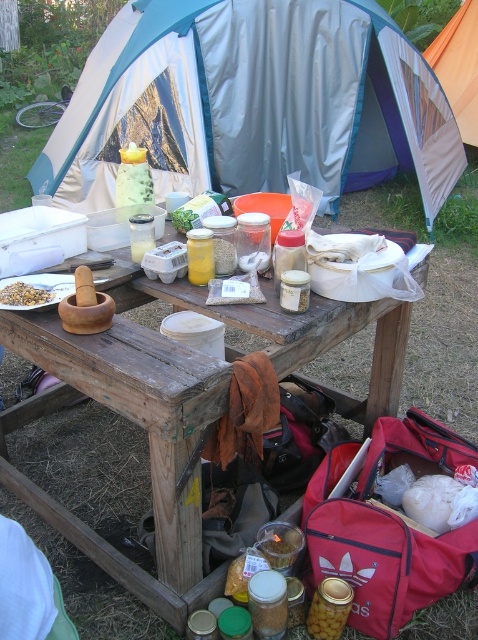
Which is above, orange fabric tent at upper center or yellow glass jar at center?

orange fabric tent at upper center is higher up.

Is orange fabric tent at upper center to the right of yellow glass jar at center from the viewer's perspective?

Yes, orange fabric tent at upper center is to the right of yellow glass jar at center.

Is point (471, 72) more distant than point (215, 252)?

That is True.

Where is `orange fabric tent at upper center`? The height and width of the screenshot is (640, 478). orange fabric tent at upper center is located at coordinates (458, 67).

Locate an element on the screen. Image resolution: width=478 pixels, height=640 pixels. orange fabric tent at upper center is located at coordinates (458, 67).

Which is in front, point (463, 138) or point (7, 305)?

Point (7, 305) is in front.

I want to click on orange fabric tent at upper center, so click(458, 67).

Is the position of wooden picnic table at center more distant than that of orange fabric tent at upper center?

No.

What do you see at coordinates (138, 424) in the screenshot? Image resolution: width=478 pixels, height=640 pixels. I see `wooden picnic table at center` at bounding box center [138, 424].

Identify the location of wooden picnic table at center. (138, 424).